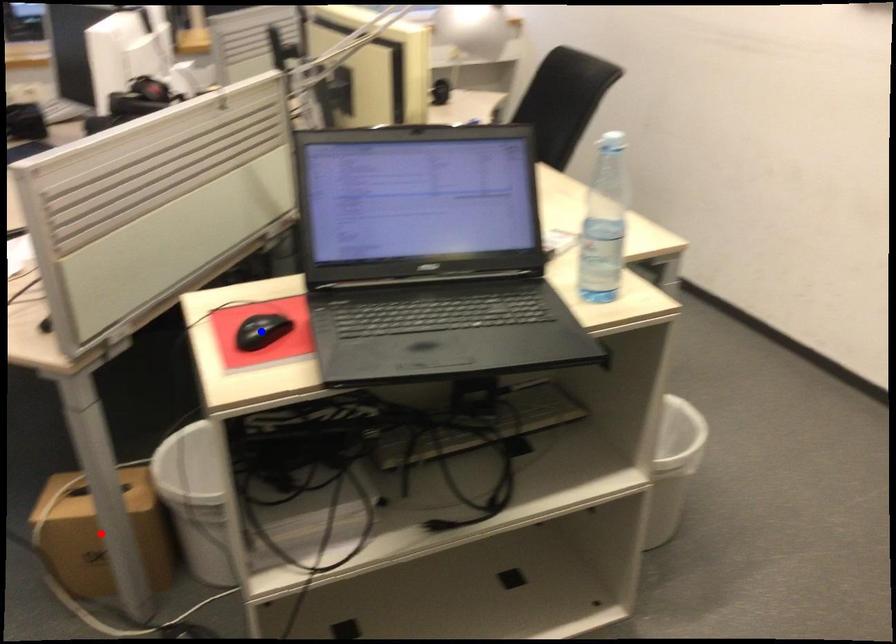
Question: In the image, two points are highlighted. Which point is nearer to the camera? Reply with the corresponding letter.

Choices:
 (A) blue point
 (B) red point

Answer: (A)